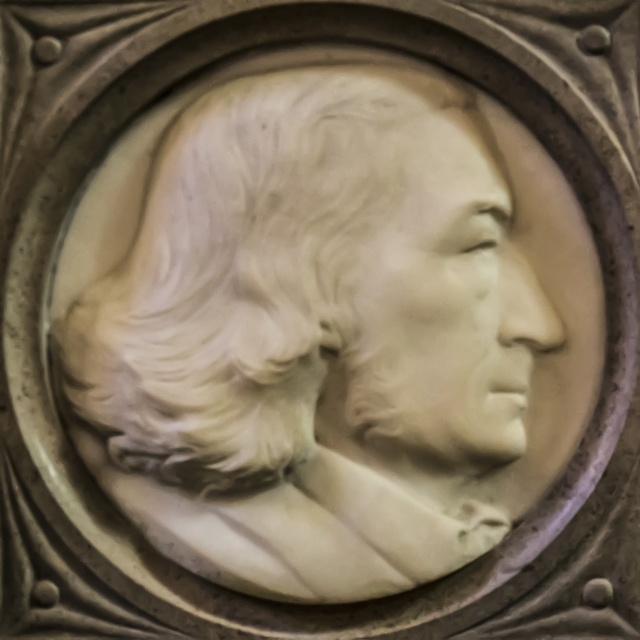
Question: Does white marble bust at center have a greater width compared to white marble face at center?

Choices:
 (A) yes
 (B) no

Answer: (A)

Question: Is white marble bust at center below white marble face at center?

Choices:
 (A) no
 (B) yes

Answer: (B)

Question: Which object appears closest to the camera in this image?

Choices:
 (A) white marble face at center
 (B) white marble bust at center

Answer: (B)

Question: Is white marble bust at center bigger than white marble face at center?

Choices:
 (A) yes
 (B) no

Answer: (A)

Question: Which of the following is the farthest from the observer?

Choices:
 (A) white marble bust at center
 (B) white marble face at center

Answer: (B)